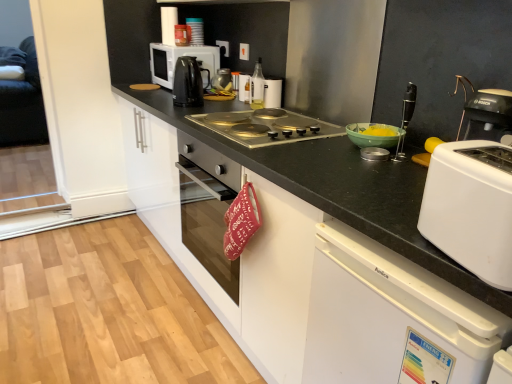
I want to click on free space in front of green matte bowl at right, so click(x=374, y=162).